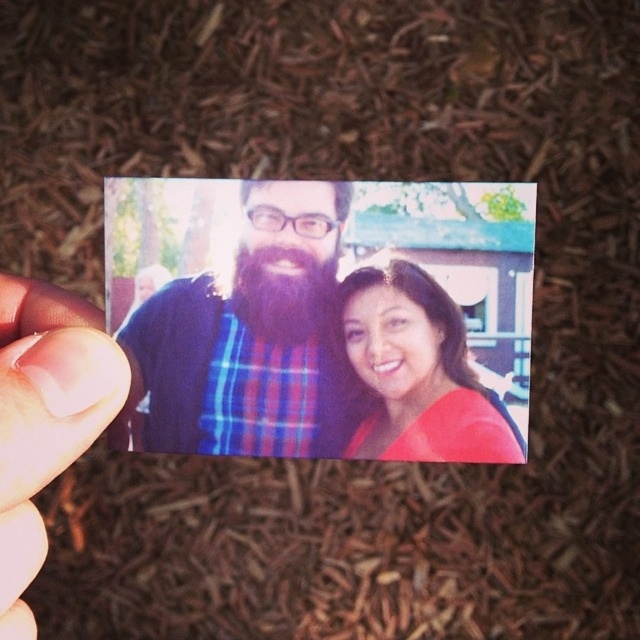
Question: Does plaid fabric shirt at center appear on the left side of pale skin at center?

Choices:
 (A) yes
 (B) no

Answer: (B)

Question: Among these points, which one is farthest from the camera?

Choices:
 (A) (118, 387)
 (B) (316, 246)

Answer: (B)

Question: Can you confirm if plaid fabric shirt at center is bigger than pale skin at center?

Choices:
 (A) yes
 (B) no

Answer: (B)

Question: Which object is farther from the camera taking this photo?

Choices:
 (A) matte red shirt at center
 (B) plaid fabric shirt at center

Answer: (B)

Question: Can you confirm if plaid fabric shirt at center is positioned above pale skin at center?

Choices:
 (A) no
 (B) yes

Answer: (B)

Question: Which is nearer to the matte red shirt at center?

Choices:
 (A) plaid fabric shirt at center
 (B) pale skin at center

Answer: (A)